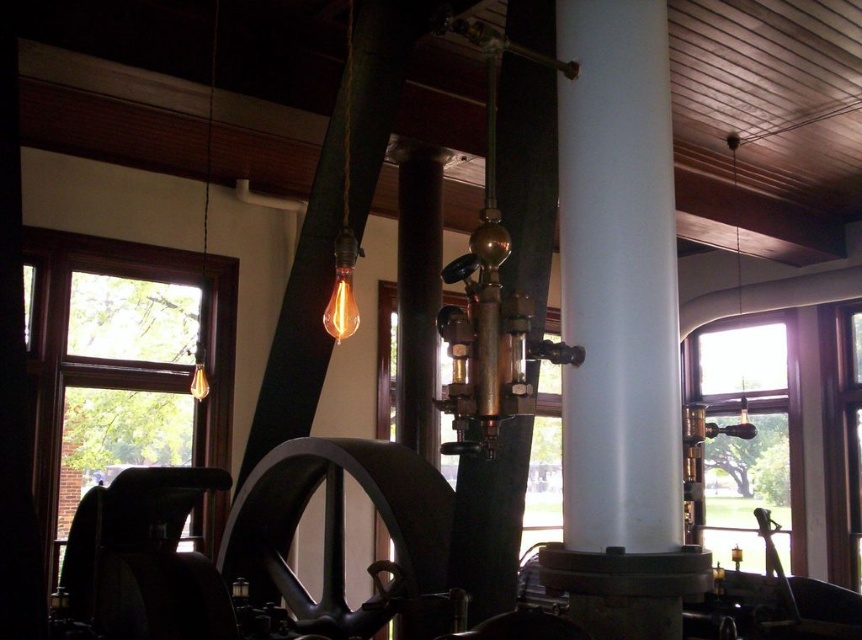
Measure the distance between white glossy pillar at center and camera.

white glossy pillar at center is 6.09 feet away from camera.

Is white glossy pillar at center thinner than clear glass window at left?

Yes, white glossy pillar at center is thinner than clear glass window at left.

The height and width of the screenshot is (640, 862). Find the location of `white glossy pillar at center`. white glossy pillar at center is located at coordinates (617, 280).

Locate an element on the screen. white glossy pillar at center is located at coordinates (617, 280).

Which is behind, point (117, 292) or point (728, 547)?

Point (728, 547)

Is clear glass window at left smaller than clear glass window at right?

Incorrect, clear glass window at left is not smaller in size than clear glass window at right.

Does point (61, 438) lie behind point (754, 337)?

That is False.

Find the location of a particular element. This screenshot has height=640, width=862. clear glass window at left is located at coordinates (123, 364).

Is white glossy pillar at center positioned before clear glass window at right?

Yes, it is in front of clear glass window at right.

Does white glossy pillar at center appear on the left side of clear glass window at right?

Indeed, white glossy pillar at center is positioned on the left side of clear glass window at right.

Where is `white glossy pillar at center`? The width and height of the screenshot is (862, 640). white glossy pillar at center is located at coordinates (617, 280).